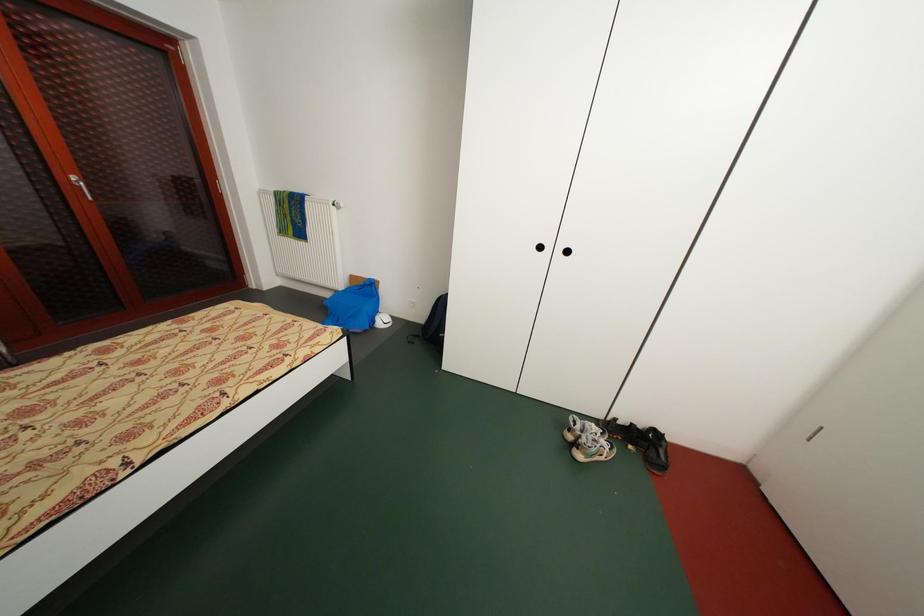
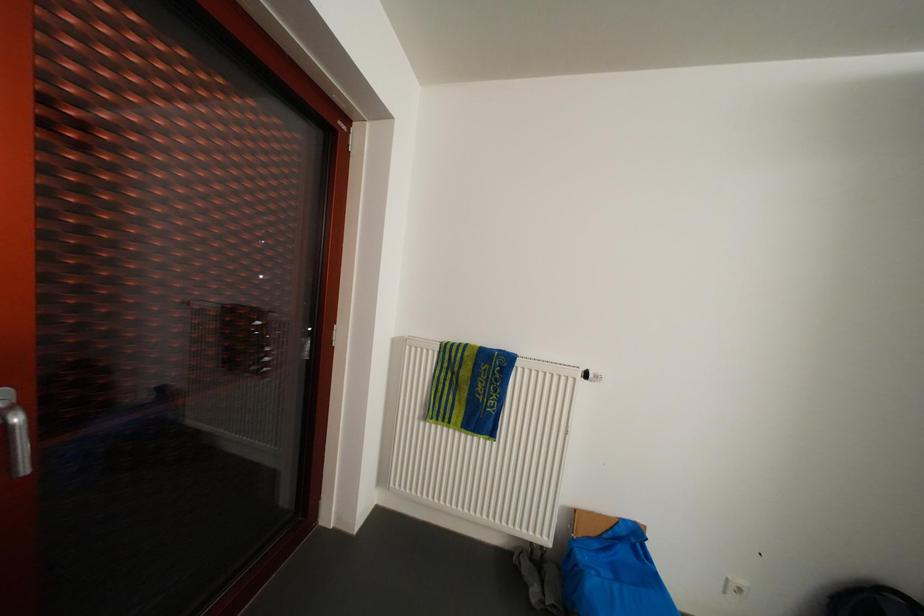
In a continuous first-person perspective shot, in which direction is the camera moving?

The cameraman moved toward left, forward.